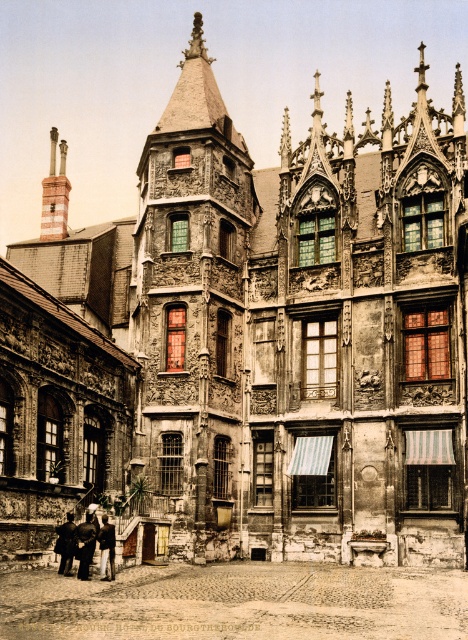
Is dark wool coat at lower left shorter than dark brown leather coat at lower left?

No, dark wool coat at lower left is not shorter than dark brown leather coat at lower left.

Between dark wool coat at lower left and dark brown leather coat at lower left, which one appears on the left side from the viewer's perspective?

From the viewer's perspective, dark wool coat at lower left appears more on the left side.

Is point (67, 525) positioned behind point (87, 528)?

Yes, it is.

Identify the location of dark wool coat at lower left. (65, 544).

Does dark brown leather coat at lower left appear under dark brown leather jacket at lower left?

Actually, dark brown leather coat at lower left is above dark brown leather jacket at lower left.

Which is in front, point (77, 529) or point (108, 554)?

Point (108, 554) is more forward.

At what (x,y) coordinates should I click in order to perform the action: click on dark brown leather coat at lower left. Please return your answer as a coordinate pair (x, y). This screenshot has width=468, height=640. Looking at the image, I should click on (86, 545).

Measure the distance between point (55, 545) and camera.

50.39 meters

Which is more to the right, dark wool coat at lower left or dark brown leather jacket at lower left?

dark brown leather jacket at lower left

Between point (58, 547) and point (107, 524), which one is positioned behind?

Positioned behind is point (107, 524).

This screenshot has width=468, height=640. Find the location of `dark wool coat at lower left`. dark wool coat at lower left is located at coordinates (65, 544).